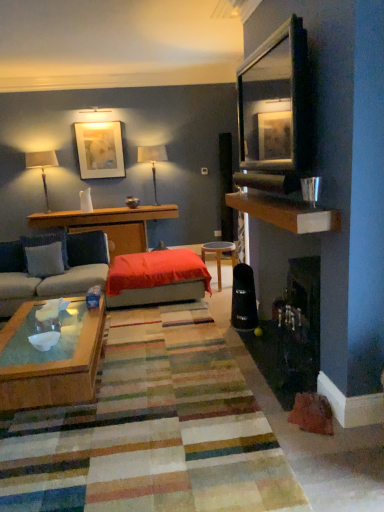
How much space does matte white lampshade at upper left, placed as the 1th lamp when sorted from left to right, occupy horizontally?

9.94 inches.

The image size is (384, 512). What do you see at coordinates (152, 160) in the screenshot? I see `matte black lampshade at upper center, the 2th lamp from the left` at bounding box center [152, 160].

Find the location of a particular element. The height and width of the screenshot is (512, 384). white glossy bowl at center is located at coordinates (44, 340).

Identify the location of velvet red ottoman at center. (156, 278).

Measure the distance between point (120,130) and camera.

The depth of point (120,130) is 5.75 meters.

Where is `matte white lampshade at upper left, placed as the 2th lamp when sorted from right to left`? The image size is (384, 512). matte white lampshade at upper left, placed as the 2th lamp when sorted from right to left is located at coordinates pyautogui.click(x=42, y=166).

From the picture: Which object is closer to the camera, matte black lampshade at upper center, the 2th lamp from the left, or light blue fabric pillow at left, marked as the 1th pillow in a front-to-back arrangement?

Positioned in front is light blue fabric pillow at left, marked as the 1th pillow in a front-to-back arrangement.

From the picture: Which of these two, matte black lampshade at upper center, the 2th lamp from the left, or light blue fabric pillow at left, which is counted as the 2th pillow, starting from the back, is smaller?

Smaller between the two is light blue fabric pillow at left, which is counted as the 2th pillow, starting from the back.

Are matte black lampshade at upper center, the 2th lamp from the left, and light blue fabric pillow at left, marked as the 1th pillow in a front-to-back arrangement, making contact?

matte black lampshade at upper center, the 2th lamp from the left, is not next to light blue fabric pillow at left, marked as the 1th pillow in a front-to-back arrangement, and they're not touching.

From the image's perspective, is velvet red ottoman at center beneath matte white picture frame at upper center?

Yes, from the image's perspective, velvet red ottoman at center is below matte white picture frame at upper center.

Based on the photo, can you confirm if velvet red ottoman at center is positioned to the right of matte white picture frame at upper center?

Indeed, velvet red ottoman at center is positioned on the right side of matte white picture frame at upper center.

Does velvet red ottoman at center turn towards matte white picture frame at upper center?

No, velvet red ottoman at center is not facing towards matte white picture frame at upper center.

Does velvet red ottoman at center have a larger size compared to matte white picture frame at upper center?

Indeed, velvet red ottoman at center has a larger size compared to matte white picture frame at upper center.

How many degrees apart are the facing directions of woodendesk at left and matte black lampshade at upper center, the 1th lamp viewed from the right?

They differ by 1.27 degrees in their facing directions.

Is woodendesk at left oriented towards matte black lampshade at upper center, the 2th lamp from the left?

No, woodendesk at left is not aimed at matte black lampshade at upper center, the 2th lamp from the left.

Is the depth of woodendesk at left greater than that of matte black lampshade at upper center, the 2th lamp from the left?

No.

Does woodendesk at left have a greater height compared to matte black lampshade at upper center, the 2th lamp from the left?

No.

Is woodendesk at left with matte white picture frame at upper center?

No, woodendesk at left is not with matte white picture frame at upper center.

Is woodendesk at left oriented away from matte white picture frame at upper center?

woodendesk at left does not have its back to matte white picture frame at upper center.

Looking at this image, visually, is woodendesk at left positioned to the left or to the right of matte white picture frame at upper center?

woodendesk at left is to the right of matte white picture frame at upper center.

Consider the image. Considering the relative sizes of woodendesk at left and matte white picture frame at upper center in the image provided, is woodendesk at left wider than matte white picture frame at upper center?

Indeed, woodendesk at left has a greater width compared to matte white picture frame at upper center.

From the image's perspective, does light blue fabric pillow at left, marked as the 1th pillow in a front-to-back arrangement, appear lower than velvet red ottoman at center?

Actually, light blue fabric pillow at left, marked as the 1th pillow in a front-to-back arrangement, appears above velvet red ottoman at center in the image.

Are light blue fabric pillow at left, which is counted as the 2th pillow, starting from the back, and velvet red ottoman at center making contact?

No, light blue fabric pillow at left, which is counted as the 2th pillow, starting from the back, is not in contact with velvet red ottoman at center.

How many degrees apart are the facing directions of light blue fabric pillow at left, which is counted as the 2th pillow, starting from the back, and velvet red ottoman at center?

The facing directions of light blue fabric pillow at left, which is counted as the 2th pillow, starting from the back, and velvet red ottoman at center are 8.36 degrees apart.

Is light blue fabric pillow at left, which is counted as the 2th pillow, starting from the back, positioned behind velvet red ottoman at center?

Yes, light blue fabric pillow at left, which is counted as the 2th pillow, starting from the back, is further from the viewer.

Can you confirm if wooden shelf at upper right is wider than clear glass cup at upper right?

Yes, wooden shelf at upper right is wider than clear glass cup at upper right.

Considering the relative sizes of wooden shelf at upper right and clear glass cup at upper right in the image provided, is wooden shelf at upper right shorter than clear glass cup at upper right?

Yes.

Is wooden shelf at upper right positioned with its back to clear glass cup at upper right?

No, wooden shelf at upper right's orientation is not away from clear glass cup at upper right.

Is matte white lampshade at upper left, placed as the 1th lamp when sorted from left to right, in contact with matte white picture frame at upper center?

No, matte white lampshade at upper left, placed as the 1th lamp when sorted from left to right, is not in contact with matte white picture frame at upper center.

From the picture: Considering their positions, is matte white lampshade at upper left, placed as the 1th lamp when sorted from left to right, located in front of or behind matte white picture frame at upper center?

matte white lampshade at upper left, placed as the 1th lamp when sorted from left to right, is positioned closer to the viewer than matte white picture frame at upper center.

Can you confirm if matte white lampshade at upper left, placed as the 2th lamp when sorted from right to left, is thinner than matte white picture frame at upper center?

In fact, matte white lampshade at upper left, placed as the 2th lamp when sorted from right to left, might be wider than matte white picture frame at upper center.

Can you tell me how much matte white lampshade at upper left, placed as the 2th lamp when sorted from right to left, and matte white picture frame at upper center differ in facing direction?

1.2 degrees.

What are the coordinates of `the 2nd pillow in front of the matte black lampshade at upper center, the 1th lamp viewed from the right` in the screenshot? It's located at (44, 259).

At what (x,y) coordinates should I click in order to perform the action: click on picture frame above the velvet red ottoman at center (from the image's perspective). Please return your answer as a coordinate pair (x, y). Looking at the image, I should click on (100, 150).

Estimate the real-world distances between objects in this image. Which object is further from white glossy bowl at center, wooden stool at center or velvet red ottoman at center?

The object further to white glossy bowl at center is wooden stool at center.

Estimate the real-world distances between objects in this image. Which object is further from woodendesk at left, matte white lampshade at upper left, placed as the 2th lamp when sorted from right to left, or matte black lampshade at upper center, the 2th lamp from the left?

matte white lampshade at upper left, placed as the 2th lamp when sorted from right to left.

From the picture: Based on their spatial positions, is white glossy bowl at center or clear glass cup at upper right closer to wooden stool at center?

clear glass cup at upper right.

Considering their positions, is clear glass cup at upper right positioned closer to white glossy bowl at center than velvet red ottoman at center?

clear glass cup at upper right lies closer to white glossy bowl at center than the other object.

Estimate the real-world distances between objects in this image. Which object is closer to matte black lampshade at upper center, the 2th lamp from the left, wooden stool at center or matte white picture frame at upper center?

Among the two, matte white picture frame at upper center is located nearer to matte black lampshade at upper center, the 2th lamp from the left.

Estimate the real-world distances between objects in this image. Which object is closer to matte black lampshade at upper center, the 2th lamp from the left, light blue fabric pillow at left, which is counted as the 2th pillow, starting from the back, or woodendesk at left?

The object closer to matte black lampshade at upper center, the 2th lamp from the left, is woodendesk at left.

Considering their positions, is matte black lampshade at upper center, the 2th lamp from the left, positioned closer to woodendesk at left than matte white picture frame at upper center?

matte black lampshade at upper center, the 2th lamp from the left, lies closer to woodendesk at left than the other object.

Estimate the real-world distances between objects in this image. Which object is further from wooden shelf at upper right, light blue fabric pillow at left, which is counted as the 2th pillow, starting from the back, or woodendesk at left?

woodendesk at left is further to wooden shelf at upper right.

The height and width of the screenshot is (512, 384). What are the coordinates of `desk between matte white lampshade at upper left, placed as the 1th lamp when sorted from left to right, and matte black lampshade at upper center, the 1th lamp viewed from the right, from left to right` in the screenshot? It's located at (109, 224).

Image resolution: width=384 pixels, height=512 pixels. Identify the location of table between white glossy bowl at center and blue fabric pillow at left, the first pillow positioned from the back, in the front-back direction. (220, 256).

This screenshot has width=384, height=512. I want to click on bowl between clear glass cup at upper right and wooden stool at center from front to back, so click(44, 340).

This screenshot has width=384, height=512. I want to click on bowl positioned between wooden shelf at upper right and matte white lampshade at upper left, placed as the 2th lamp when sorted from right to left, from near to far, so click(44, 340).